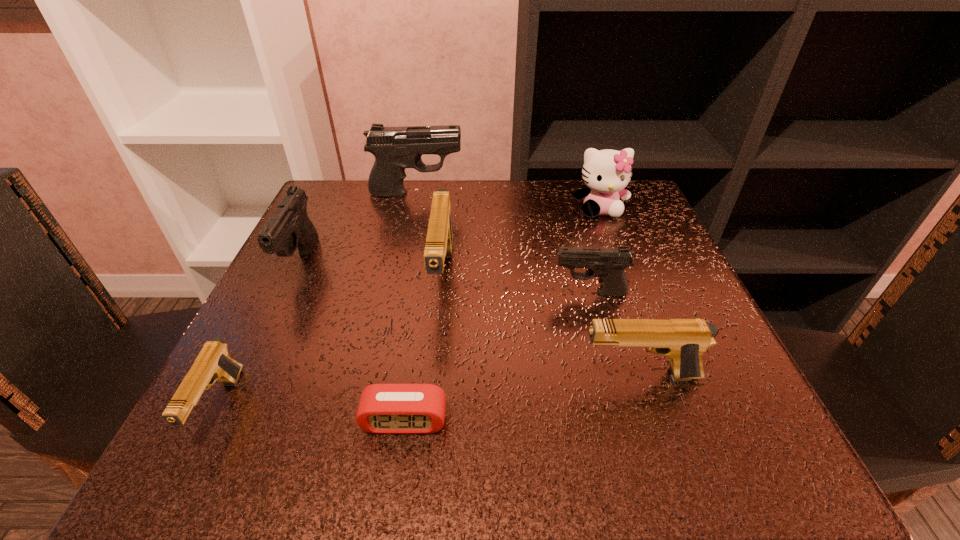
You are a GUI agent. You are given a task and a screenshot of the screen. Output one action in this format:
    pyautogui.click(x=<x>, y=<y>)
    Task: Click on the tan pistol that stands as the second closest to the smallest tan pistol
    This screenshot has height=540, width=960.
    Given the screenshot: What is the action you would take?
    pyautogui.click(x=684, y=341)

Locate which tan pistol ranks in proximity to the smallest tan pistol. Please provide its 2D coordinates. Your answer should be formatted as a tuple, i.e. [(x, y)], where the tuple contains the x and y coordinates of a point satisfying the conditions above.

[(439, 240)]

The width and height of the screenshot is (960, 540). I want to click on free space that satisfies the following two spatial constraints: 1. at the barrel of the second biggest tan pistol; 2. at the barrel of the smallest tan pistol, so click(x=650, y=407).

Locate an element on the screen. The image size is (960, 540). vacant space that satisfies the following two spatial constraints: 1. at the barrel of the rightmost black pistol; 2. on the front-facing side of the shortest object is located at coordinates (625, 421).

Where is `free space that satisfies the following two spatial constraints: 1. at the barrel of the rightmost tan pistol; 2. on the front-facing side of the pink alarm clock`? The image size is (960, 540). free space that satisfies the following two spatial constraints: 1. at the barrel of the rightmost tan pistol; 2. on the front-facing side of the pink alarm clock is located at coordinates (655, 421).

Locate an element on the screen. free space that satisfies the following two spatial constraints: 1. at the barrel of the farthest black pistol; 2. at the barrel of the leftmost black pistol is located at coordinates (401, 263).